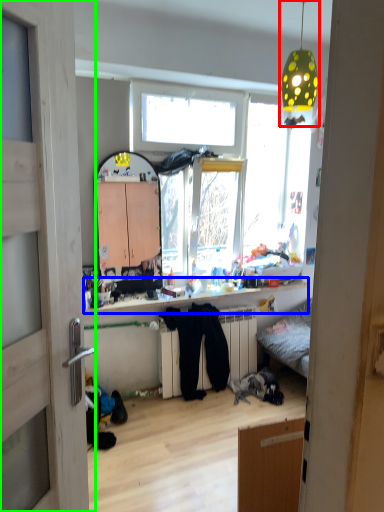
Question: Which object is the closest to the light fixture (highlighted by a red box)? Choose among these: counter top (highlighted by a blue box) or door (highlighted by a green box).

Choices:
 (A) counter top
 (B) door

Answer: (A)